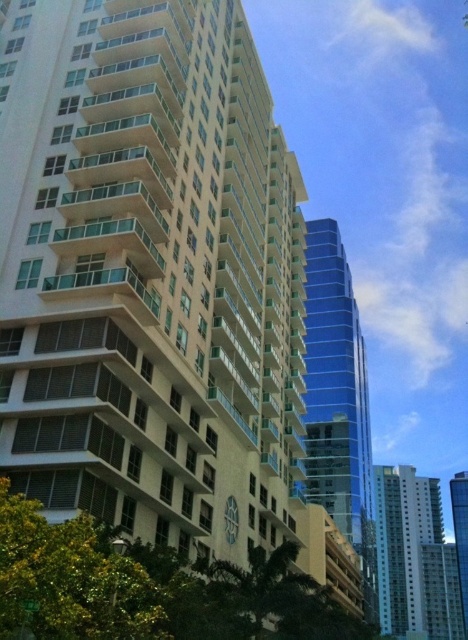
You are standing at the center of the image and want to find the green leafy tree at lower left. In which direction should you look to see it?

You should look to the lower left direction to see the green leafy tree at lower left since it is located at point (x=68, y=580).

You are a drone operator trying to capture a photo of the two points in the urban scene. The first point is labeled as point (279, 602) and the second is point (465, 573). Which point should you focus on first to ensure it appears larger in your camera frame?

Point (279, 602) is closer to the camera than point (465, 573), so focusing on point (279, 602) first will make it appear larger in the camera frame.